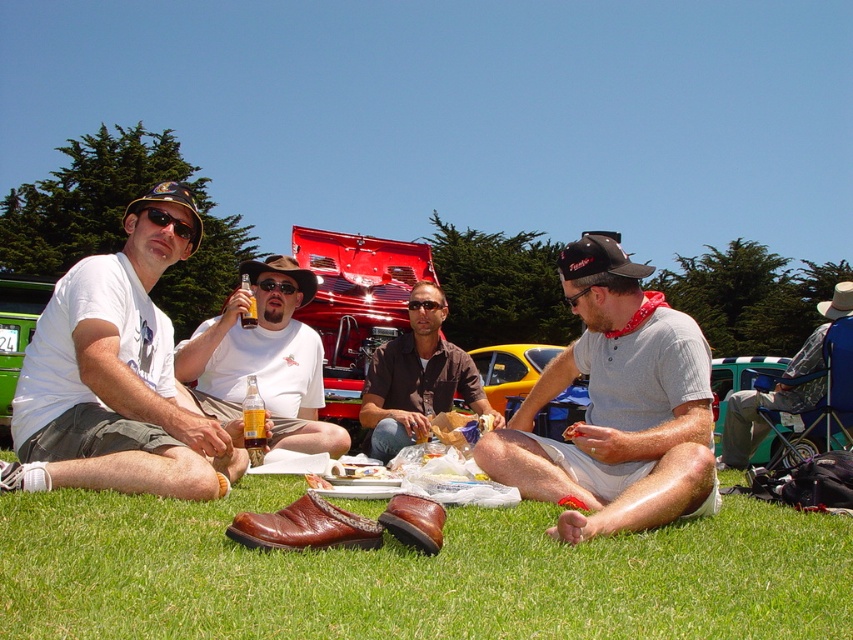
Is green grass at lower center below denim jacket at lower right?

Yes.

Is point (183, 554) closer to viewer compared to point (723, 433)?

Yes.

You are a GUI agent. You are given a task and a screenshot of the screen. Output one action in this format:
    pyautogui.click(x=<x>, y=<y>)
    Task: Click on the green grass at lower center
    This screenshot has width=853, height=640.
    Given the screenshot: What is the action you would take?
    pyautogui.click(x=413, y=573)

Between white cotton t-shirt at left and matte white shirt at center, which one is positioned higher?

white cotton t-shirt at left is higher up.

Find the location of `white cotton t-shirt at left`. white cotton t-shirt at left is located at coordinates (119, 372).

Between gray cotton shirt at center and denim jacket at lower right, which one is positioned lower?

Positioned lower is gray cotton shirt at center.

At what (x,y) coordinates should I click in order to perform the action: click on gray cotton shirt at center. Please return your answer as a coordinate pair (x, y). Image resolution: width=853 pixels, height=640 pixels. Looking at the image, I should click on (616, 406).